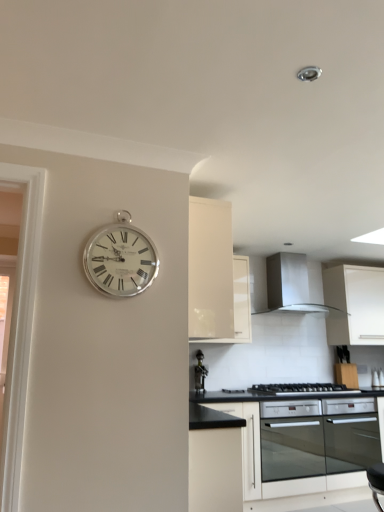
Question: Can you confirm if white glossy cabinet at upper center, placed as the 1th cabinetry when sorted from left to right, is taller than silver metallic clock at upper left?

Choices:
 (A) yes
 (B) no

Answer: (A)

Question: Is white glossy cabinet at upper center, placed as the 1th cabinetry when sorted from left to right, bigger than silver metallic clock at upper left?

Choices:
 (A) yes
 (B) no

Answer: (A)

Question: From the image's perspective, is white glossy cabinet at upper center, placed as the 3th cabinetry when sorted from right to left, located beneath silver metallic clock at upper left?

Choices:
 (A) no
 (B) yes

Answer: (B)

Question: From a real-world perspective, is white glossy cabinet at upper center, arranged as the 2th cabinetry when viewed from the front, physically below silver metallic clock at upper left?

Choices:
 (A) no
 (B) yes

Answer: (A)

Question: Is the position of white glossy cabinet at upper center, placed as the 3th cabinetry when sorted from right to left, less distant than that of silver metallic clock at upper left?

Choices:
 (A) yes
 (B) no

Answer: (B)

Question: Does white glossy cabinet at upper center, the second cabinetry viewed from the back, touch silver metallic clock at upper left?

Choices:
 (A) yes
 (B) no

Answer: (B)

Question: Is the depth of black glass oven at lower center greater than that of metallic wine rack at center?

Choices:
 (A) no
 (B) yes

Answer: (A)

Question: Is black glass oven at lower center thinner than metallic wine rack at center?

Choices:
 (A) yes
 (B) no

Answer: (B)

Question: Considering the relative sizes of black glass oven at lower center and metallic wine rack at center in the image provided, is black glass oven at lower center bigger than metallic wine rack at center?

Choices:
 (A) no
 (B) yes

Answer: (B)

Question: Can you confirm if black glass oven at lower center is wider than metallic wine rack at center?

Choices:
 (A) yes
 (B) no

Answer: (A)

Question: From a real-world perspective, is black glass oven at lower center physically below metallic wine rack at center?

Choices:
 (A) no
 (B) yes

Answer: (B)

Question: From a real-world perspective, is black glass oven at lower center located higher than metallic wine rack at center?

Choices:
 (A) no
 (B) yes

Answer: (A)

Question: From a real-world perspective, is silver metallic clock at upper left positioned over black matte gas stove at lower center based on gravity?

Choices:
 (A) yes
 (B) no

Answer: (A)